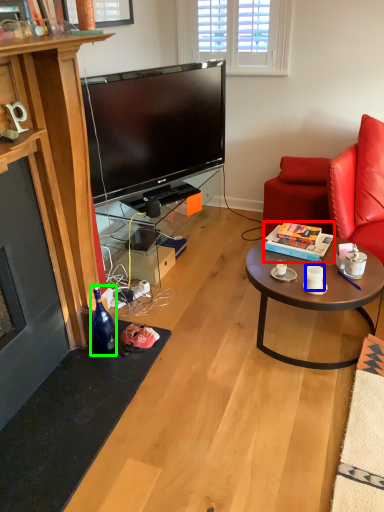
Question: Based on their relative distances, which object is nearer to box (highlighted by a red box)? Choose from coffee cup (highlighted by a blue box) and bottle (highlighted by a green box).

Choices:
 (A) coffee cup
 (B) bottle

Answer: (A)